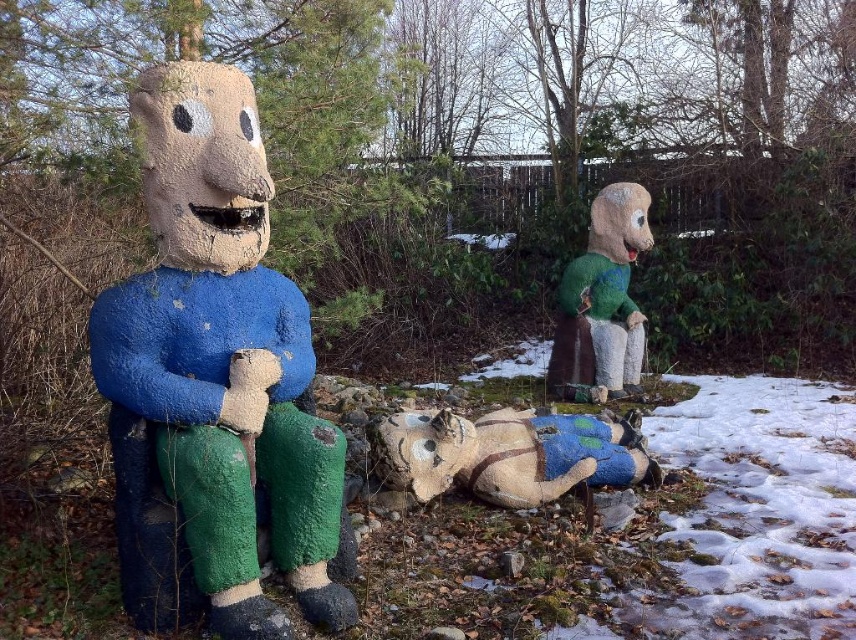
Is blue painted wood figure at left to the left of green felt doll at right from the viewer's perspective?

Yes, blue painted wood figure at left is to the left of green felt doll at right.

Is point (327, 628) positioned in front of point (627, 342)?

Yes, it is in front of point (627, 342).

Is point (107, 396) behind point (578, 330)?

No, it is not.

Locate an element on the screen. Image resolution: width=856 pixels, height=640 pixels. blue painted wood figure at left is located at coordinates (214, 381).

You are a GUI agent. You are given a task and a screenshot of the screen. Output one action in this format:
    pyautogui.click(x=<x>, y=<y>)
    Task: Click on the blue painted wood horse at center
    The height and width of the screenshot is (640, 856).
    Given the screenshot: What is the action you would take?
    pyautogui.click(x=508, y=454)

Image resolution: width=856 pixels, height=640 pixels. What are the coordinates of `blue painted wood horse at center` in the screenshot? It's located at (508, 454).

Who is more forward, (126, 608) or (525, 426)?

Point (126, 608) is in front.

Is blue painted wood figure at left to the left of blue painted wood horse at center from the viewer's perspective?

Indeed, blue painted wood figure at left is positioned on the left side of blue painted wood horse at center.

At what (x,y) coordinates should I click in order to perform the action: click on blue painted wood figure at left. Please return your answer as a coordinate pair (x, y). Looking at the image, I should click on (214, 381).